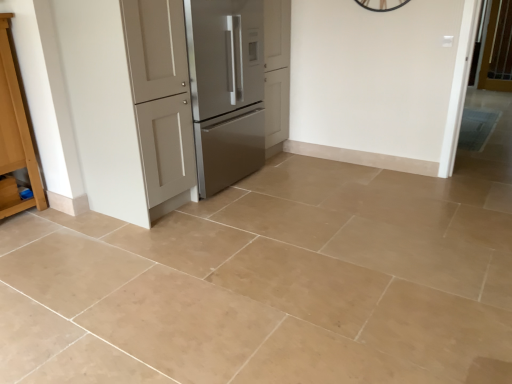
Describe the element at coordinates (226, 89) in the screenshot. I see `satin silver refrigerator at center-left` at that location.

Describe the element at coordinates (15, 129) in the screenshot. I see `light brown wood cabinet at left` at that location.

This screenshot has width=512, height=384. What are the coordinates of `satin silver refrigerator at center-left` in the screenshot? It's located at (226, 89).

Does matte white door at center have a greater width compared to light brown wood cabinet at left?

Correct, the width of matte white door at center exceeds that of light brown wood cabinet at left.

Is matte white door at center facing away from light brown wood cabinet at left?

No, matte white door at center's orientation is not away from light brown wood cabinet at left.

Can you tell me how much matte white door at center and light brown wood cabinet at left differ in facing direction?

The angular difference between matte white door at center and light brown wood cabinet at left is 88.5 degrees.

Would you consider matte white door at center to be distant from light brown wood cabinet at left?

They are positioned close to each other.

Is satin silver refrigerator at center-left not near matte white door at center?

No, satin silver refrigerator at center-left is not far away from matte white door at center.

Based on the photo, between satin silver refrigerator at center-left and matte white door at center, which one has smaller size?

With smaller size is satin silver refrigerator at center-left.

Locate an element on the screen. This screenshot has width=512, height=384. refrigerator below the matte white door at center (from a real-world perspective) is located at coordinates (226, 89).

From the image's perspective, is light brown wood cabinet at left beneath matte white door at center?

Correct, light brown wood cabinet at left appears lower than matte white door at center in the image.

Is light brown wood cabinet at left oriented away from matte white door at center?

No, light brown wood cabinet at left is not facing the opposite direction of matte white door at center.

From a real-world perspective, is light brown wood cabinet at left physically located above or below matte white door at center?

From a real-world perspective, light brown wood cabinet at left is physically below matte white door at center.

Who is bigger, light brown wood cabinet at left or matte white door at center?

matte white door at center.

From a real-world perspective, who is located higher, clear glass screen door at upper right or matte white door at center?

clear glass screen door at upper right, from a real-world perspective.

Which object is closer to the camera taking this photo, clear glass screen door at upper right or matte white door at center?

matte white door at center is closer to the camera.

From the picture: Is matte white door at center at the back of clear glass screen door at upper right?

No, clear glass screen door at upper right is not facing the opposite direction of matte white door at center.

Considering the sizes of objects light brown wood cabinet at left and satin silver refrigerator at center-left in the image provided, who is bigger, light brown wood cabinet at left or satin silver refrigerator at center-left?

Bigger between the two is satin silver refrigerator at center-left.

Based on the photo, is satin silver refrigerator at center-left surrounded by light brown wood cabinet at left?

No, satin silver refrigerator at center-left is not surrounded by light brown wood cabinet at left.

In terms of height, does light brown wood cabinet at left look taller or shorter compared to satin silver refrigerator at center-left?

Considering their sizes, light brown wood cabinet at left has less height than satin silver refrigerator at center-left.

Is the depth of light brown wood cabinet at left greater than that of satin silver refrigerator at center-left?

No, light brown wood cabinet at left is closer to the viewer.

Looking at this image, from the image's perspective, who appears lower, matte white door at center or clear glass screen door at upper right?

matte white door at center, from the image's perspective.

Would you say matte white door at center is inside or outside clear glass screen door at upper right?

matte white door at center exists outside the volume of clear glass screen door at upper right.

Considering the positions of objects matte white door at center and clear glass screen door at upper right in the image provided, who is more to the right, matte white door at center or clear glass screen door at upper right?

clear glass screen door at upper right is more to the right.

Who is taller, matte white door at center or clear glass screen door at upper right?

matte white door at center is taller.

Based on the photo, would you consider satin silver refrigerator at center-left to be distant from clear glass screen door at upper right?

Yes, satin silver refrigerator at center-left is far from clear glass screen door at upper right.

Is satin silver refrigerator at center-left wider or thinner than clear glass screen door at upper right?

Considering their sizes, satin silver refrigerator at center-left looks broader than clear glass screen door at upper right.

From a real-world perspective, is satin silver refrigerator at center-left located higher than clear glass screen door at upper right?

Incorrect, from a real-world perspective, satin silver refrigerator at center-left is lower than clear glass screen door at upper right.

Who is shorter, satin silver refrigerator at center-left or clear glass screen door at upper right?

Standing shorter between the two is clear glass screen door at upper right.

Identify the location of door above the light brown wood cabinet at left (from a real-world perspective). (130, 104).

Find the location of `door to the left of satin silver refrigerator at center-left`. door to the left of satin silver refrigerator at center-left is located at coordinates (130, 104).

Estimate the real-world distances between objects in this image. Which object is further from light brown wood cabinet at left, clear glass screen door at upper right or matte white door at center?

Based on the image, clear glass screen door at upper right appears to be further to light brown wood cabinet at left.

Looking at the image, which one is located closer to matte white door at center, satin silver refrigerator at center-left or light brown wood cabinet at left?

satin silver refrigerator at center-left lies closer to matte white door at center than the other object.

Considering their positions, is clear glass screen door at upper right positioned further to satin silver refrigerator at center-left than light brown wood cabinet at left?

The object further to satin silver refrigerator at center-left is clear glass screen door at upper right.

From the image, which object appears to be nearer to light brown wood cabinet at left, clear glass screen door at upper right or satin silver refrigerator at center-left?

satin silver refrigerator at center-left lies closer to light brown wood cabinet at left than the other object.

Looking at the image, which one is located further to matte white door at center, light brown wood cabinet at left or clear glass screen door at upper right?

The object further to matte white door at center is clear glass screen door at upper right.

Which object lies nearer to the anchor point clear glass screen door at upper right, light brown wood cabinet at left or matte white door at center?

matte white door at center lies closer to clear glass screen door at upper right than the other object.

In the scene shown: Considering their positions, is clear glass screen door at upper right positioned closer to satin silver refrigerator at center-left than matte white door at center?

Based on the image, matte white door at center appears to be nearer to satin silver refrigerator at center-left.

Looking at the image, which one is located further to satin silver refrigerator at center-left, matte white door at center or light brown wood cabinet at left?

light brown wood cabinet at left is further to satin silver refrigerator at center-left.

Find the location of `door between light brown wood cabinet at left and satin silver refrigerator at center-left`. door between light brown wood cabinet at left and satin silver refrigerator at center-left is located at coordinates (130, 104).

The height and width of the screenshot is (384, 512). Identify the location of door situated between light brown wood cabinet at left and clear glass screen door at upper right from left to right. (x=130, y=104).

Find the location of a particular element. refrigerator located between matte white door at center and clear glass screen door at upper right in the left-right direction is located at coordinates (226, 89).

I want to click on refrigerator between light brown wood cabinet at left and clear glass screen door at upper right from left to right, so click(226, 89).